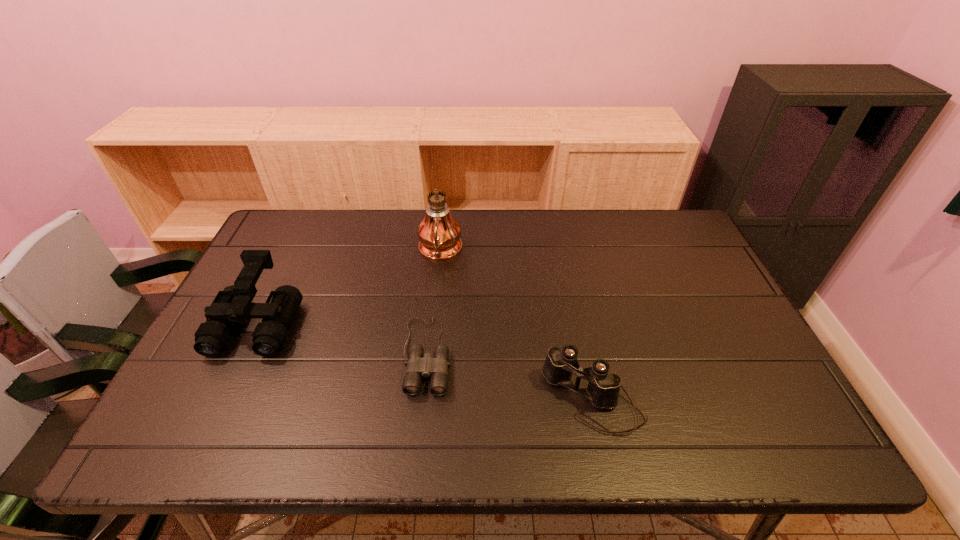
Find the location of a particular element. This screenshot has height=540, width=960. the farthest object is located at coordinates (439, 233).

Image resolution: width=960 pixels, height=540 pixels. I want to click on the tallest object, so click(x=439, y=233).

At what (x,y) coordinates should I click in order to perform the action: click on the leftmost object. Please return your answer as a coordinate pair (x, y). Looking at the image, I should click on (232, 305).

The width and height of the screenshot is (960, 540). I want to click on the leftmost binoculars, so click(x=232, y=305).

Where is `the rightmost binoculars`? Image resolution: width=960 pixels, height=540 pixels. the rightmost binoculars is located at coordinates (603, 388).

You are a GUI agent. You are given a task and a screenshot of the screen. Output one action in this format:
    pyautogui.click(x=<x>, y=<y>)
    Task: Click on the second tallest binoculars
    The image size is (960, 540).
    Given the screenshot: What is the action you would take?
    pyautogui.click(x=603, y=388)

The width and height of the screenshot is (960, 540). Find the location of `the second binoculars from left to right`. the second binoculars from left to right is located at coordinates (418, 366).

Where is `the shortest object`? Image resolution: width=960 pixels, height=540 pixels. the shortest object is located at coordinates (418, 366).

Find the location of `free space located on the front of the farthest object`. free space located on the front of the farthest object is located at coordinates (433, 322).

You are a GUI agent. You are given a task and a screenshot of the screen. Output one action in this format:
    pyautogui.click(x=<x>, y=<y>)
    Task: Click on the free space located 0.220m on the front lenses of the third shortest object
    Image resolution: width=960 pixels, height=540 pixels.
    Given the screenshot: What is the action you would take?
    pyautogui.click(x=201, y=442)